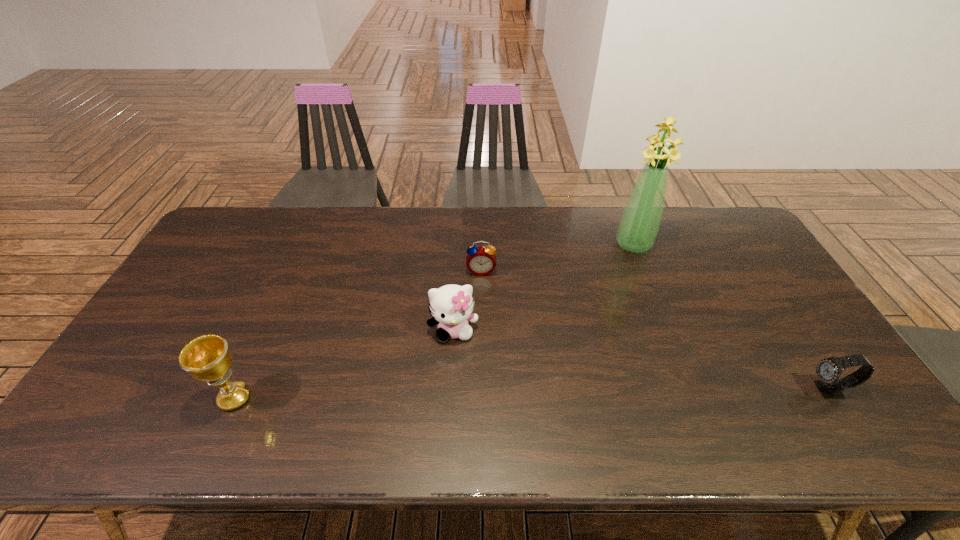
At what (x,y) coordinates should I click in order to perform the action: click on the leftmost object. Please return your answer as a coordinate pair (x, y). The image size is (960, 540). Looking at the image, I should click on (207, 358).

Identify the location of watch. This screenshot has height=540, width=960. (828, 370).

You are a GUI agent. You are given a task and a screenshot of the screen. Output one action in this format:
    pyautogui.click(x=<x>, y=<y>)
    Task: Click on the kitten
    
    Given the screenshot: What is the action you would take?
    pyautogui.click(x=451, y=306)

Image resolution: width=960 pixels, height=540 pixels. Identify the location of the third farthest object. (451, 306).

The image size is (960, 540). Find the location of `the second farthest object`. the second farthest object is located at coordinates (481, 260).

Locate an element on the screen. This screenshot has height=540, width=960. bouquet is located at coordinates (639, 224).

Find the location of `the farthest object`. the farthest object is located at coordinates (639, 224).

Find the location of `vacant space positioned 0.110m on the back of the leftmost object`. vacant space positioned 0.110m on the back of the leftmost object is located at coordinates (258, 346).

Find the location of a particular element. The width and height of the screenshot is (960, 540). vacant space positioned 0.200m on the face of the watch is located at coordinates (728, 390).

At what (x,y) coordinates should I click in order to perform the action: click on free space located 0.100m on the face of the watch. Please return your answer as a coordinate pair (x, y). The width and height of the screenshot is (960, 540). Looking at the image, I should click on (768, 390).